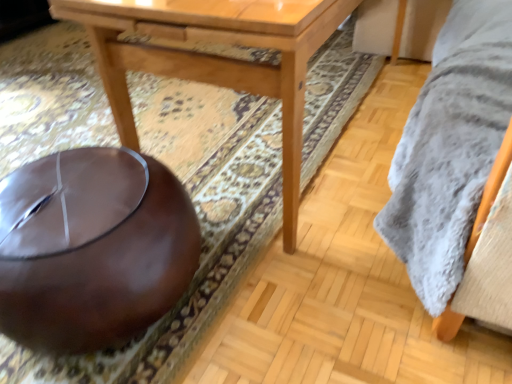
Locate an element on the screen. Image resolution: width=512 pixels, height=384 pixels. empty space that is ontop of brown leather bean bag at lower left (from a real-world perspective) is located at coordinates (78, 198).